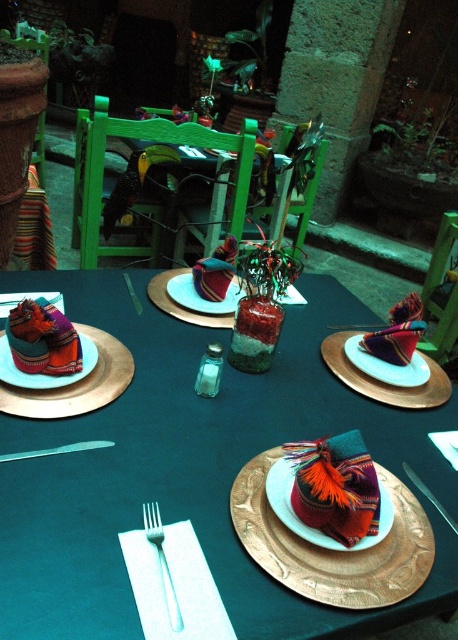
Does textured fabric pouch at center have a smaller size compared to metallic knife at center?

No.

Can you confirm if textured fabric pouch at center is taller than metallic knife at center?

Correct, textured fabric pouch at center is much taller as metallic knife at center.

Who is more distant from viewer, (416, 579) or (383, 323)?

Positioned behind is point (383, 323).

You are a GUI agent. You are given a task and a screenshot of the screen. Output one action in this format:
    pyautogui.click(x=<x>, y=<y>)
    Task: Click on the textured fabric pouch at center
    Image resolution: width=458 pixels, height=640 pixels.
    Given the screenshot: What is the action you would take?
    pyautogui.click(x=332, y=548)

Does matte glass plate at center appear on the right side of metallic knife at center?

In fact, matte glass plate at center is to the left of metallic knife at center.

Is point (170, 296) farther from viewer compared to point (359, 323)?

That is False.

Locate an element on the screen. The width and height of the screenshot is (458, 640). matte glass plate at center is located at coordinates (191, 300).

Which is more to the right, multicolored woven cloth at center or metallic knife at center?

From the viewer's perspective, metallic knife at center appears more on the right side.

Measure the distance between multicolored woven cloth at center and camera.

multicolored woven cloth at center and camera are 38.67 inches apart from each other.

Locate an element on the screen. This screenshot has width=458, height=640. multicolored woven cloth at center is located at coordinates (43, 339).